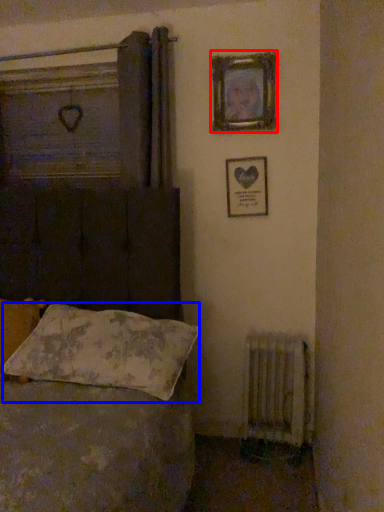
Question: Which of the following is the closest to the observer, picture frame (highlighted by a red box) or pillow (highlighted by a blue box)?

Choices:
 (A) picture frame
 (B) pillow

Answer: (B)